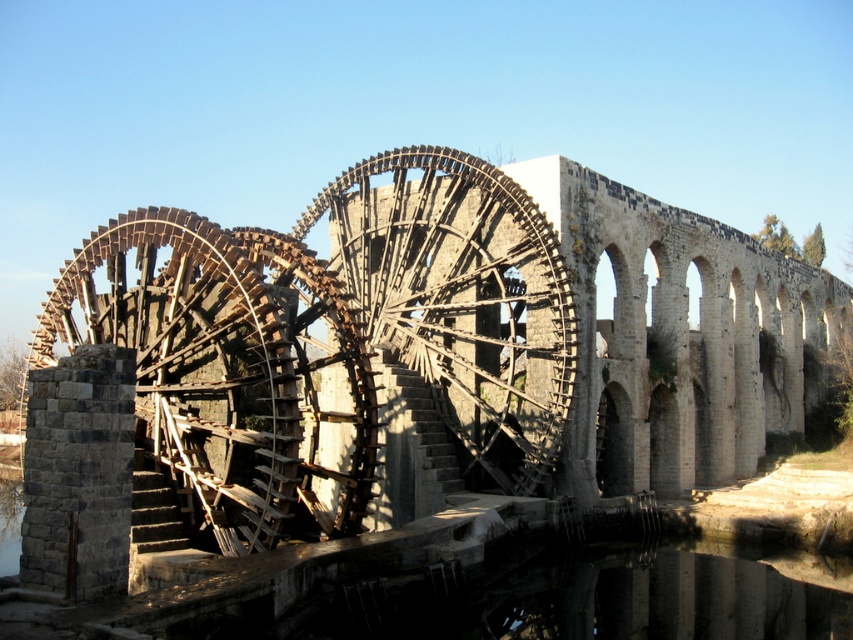
In the scene shown: You are standing in front of a historical waterwheel structure. You want to take a photo of the wooden waterwheel at left from a distance that allows you to capture the entire structure in one frame. Considering the camera you have can capture a maximum distance of 150 feet, will you be able to take the photo without moving closer?

The wooden waterwheel at left is 168.52 feet away from the camera. Since the camera can only capture up to 150 feet, you will not be able to capture the entire structure in one frame without moving closer.

You are a maintenance worker standing at the wooden spokes at center and need to inspect the wooden waterwheel at left. Can you walk directly to it without crossing any obstacles? The path between them is straight. The minimum safe distance for walking is 23 meters.

The wooden waterwheel at left is 22.99 meters away from wooden spokes at center. Since the minimum safe distance for walking is 23 meters, the distance is slightly shorter than required, so you cannot walk directly to it safely.